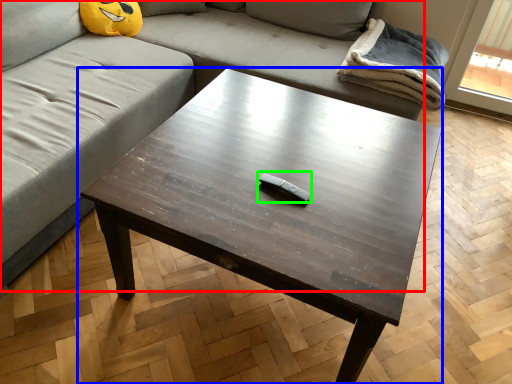
Question: Which is nearer to the studio couch (highlighted by a red box)? coffee table (highlighted by a blue box) or Wii controller (highlighted by a green box).

Choices:
 (A) coffee table
 (B) Wii controller

Answer: (A)